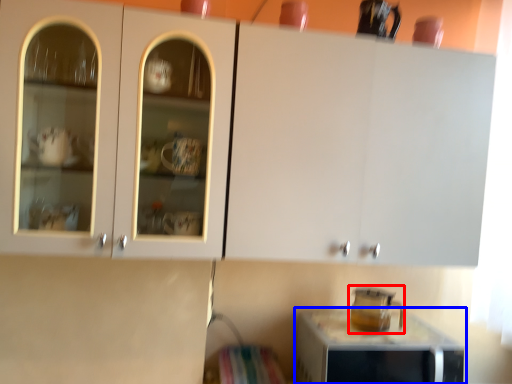
Question: Which object appears closest to the camera in this image, appliance (highlighted by a red box) or home appliance (highlighted by a blue box)?

Choices:
 (A) appliance
 (B) home appliance

Answer: (B)